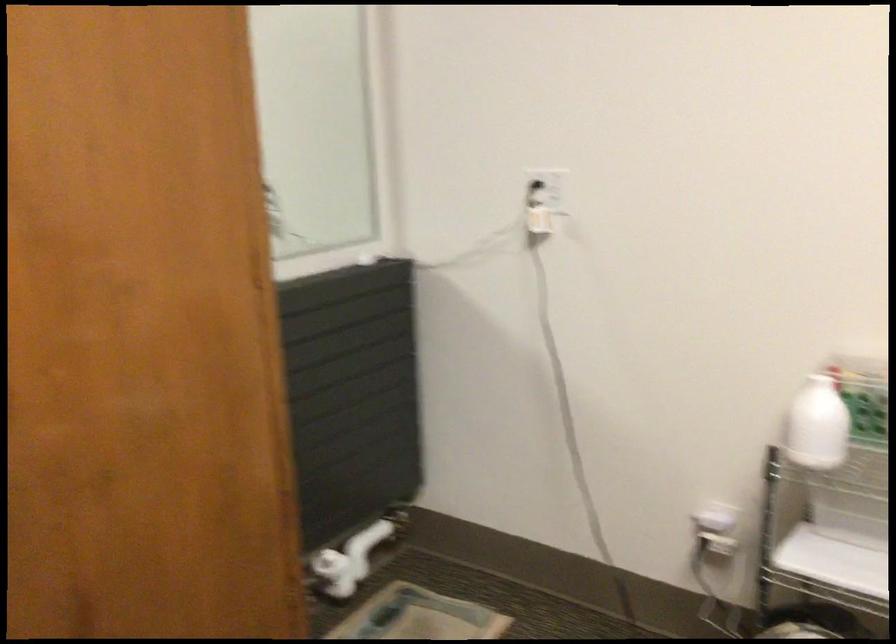
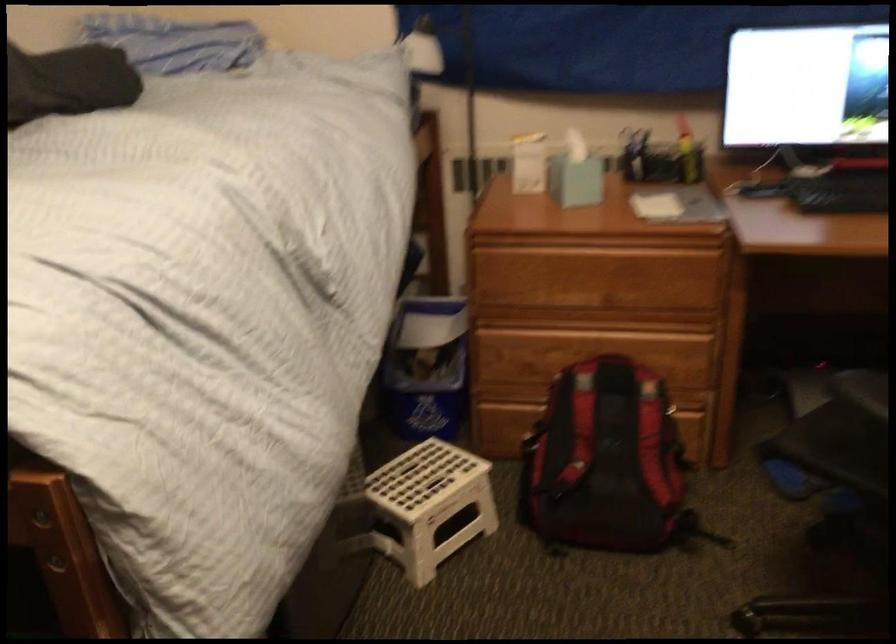
First-person continuous shooting, in which direction is the camera rotating?

The rotation direction of the camera is right-down.